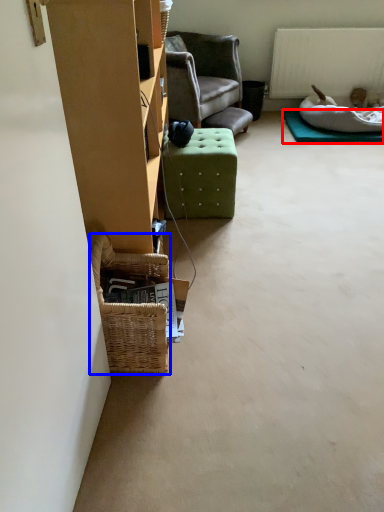
Question: Which object is closer to the camera taking this photo, mat (highlighted by a red box) or picnic basket (highlighted by a blue box)?

Choices:
 (A) mat
 (B) picnic basket

Answer: (B)